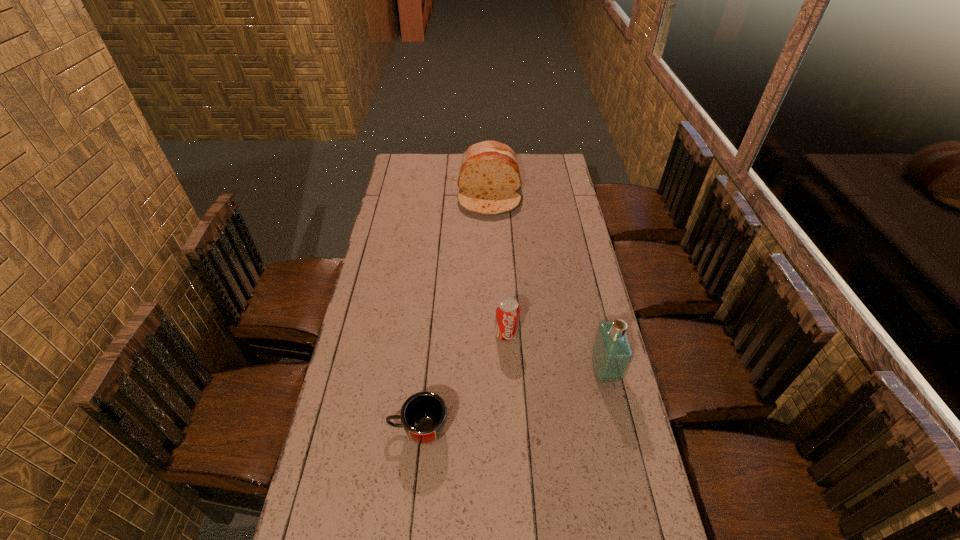
Identify the location of mug. The width and height of the screenshot is (960, 540). (424, 415).

Locate an element on the screen. The width and height of the screenshot is (960, 540). the nearest object is located at coordinates (424, 415).

Identify the location of the third farthest object. (611, 354).

Find the location of a particular element. the tallest object is located at coordinates (611, 354).

At what (x,y) coordinates should I click in order to perform the action: click on the second shortest object. Please return your answer as a coordinate pair (x, y). The width and height of the screenshot is (960, 540). Looking at the image, I should click on pyautogui.click(x=507, y=310).

At what (x,y) coordinates should I click in order to perform the action: click on the third nearest object. Please return your answer as a coordinate pair (x, y). This screenshot has width=960, height=540. Looking at the image, I should click on (507, 310).

This screenshot has height=540, width=960. I want to click on bread, so click(489, 176).

The height and width of the screenshot is (540, 960). In order to click on the second tallest object in this screenshot , I will do `click(489, 176)`.

Where is `vacant position located 0.160m on the side of the nearest object with the handle`? This screenshot has height=540, width=960. vacant position located 0.160m on the side of the nearest object with the handle is located at coordinates (335, 429).

Where is `vacant point located 0.110m on the side of the nearest object with the handle`? This screenshot has width=960, height=540. vacant point located 0.110m on the side of the nearest object with the handle is located at coordinates (351, 429).